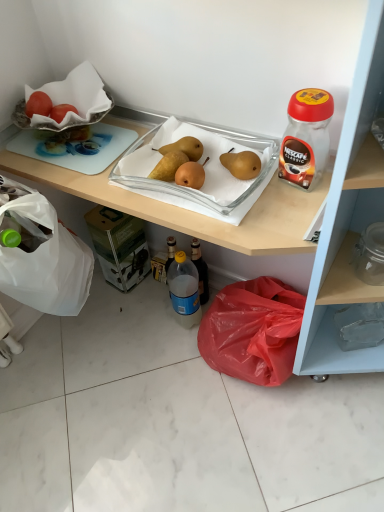
The height and width of the screenshot is (512, 384). I want to click on vacant region in front of matte plastic cabinet at lower right, so click(213, 439).